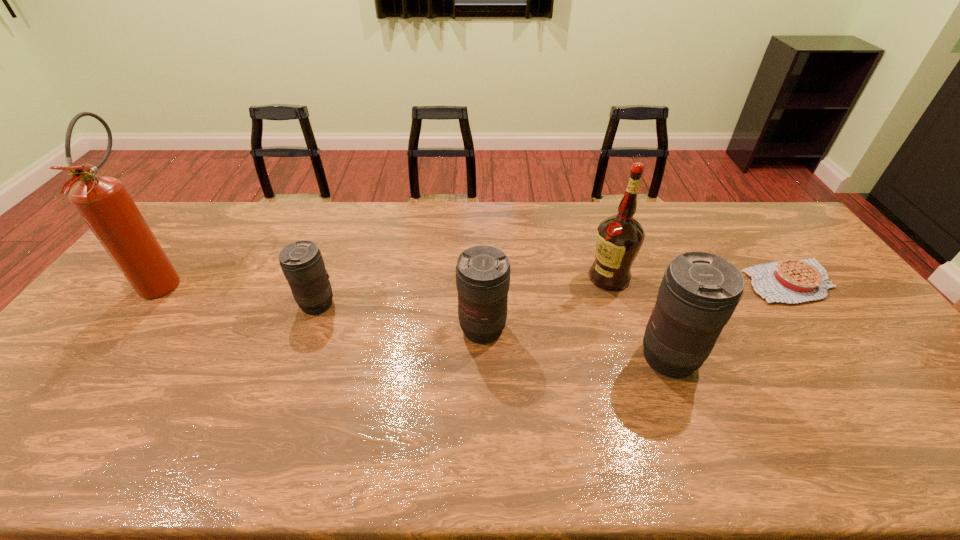
You are a GUI agent. You are given a task and a screenshot of the screen. Output one action in this format:
    pyautogui.click(x=<x>, y=<y>)
    Task: Click on the vacant region that satisfies the following two spatial constraints: 1. on the front side of the pie; 2. on the side of the rightmost telephoto lens where the control switches are located
    This screenshot has width=960, height=540.
    Given the screenshot: What is the action you would take?
    (x=846, y=357)

Locate an element on the screen. This screenshot has width=960, height=540. free space that satisfies the following two spatial constraints: 1. on the label of the second tallest object; 2. from the nozzle of the tallest object is located at coordinates (610, 280).

Locate an element on the screen. vacant area that satisfies the following two spatial constraints: 1. on the label of the fifth shortest object; 2. on the right side of the pie is located at coordinates (611, 282).